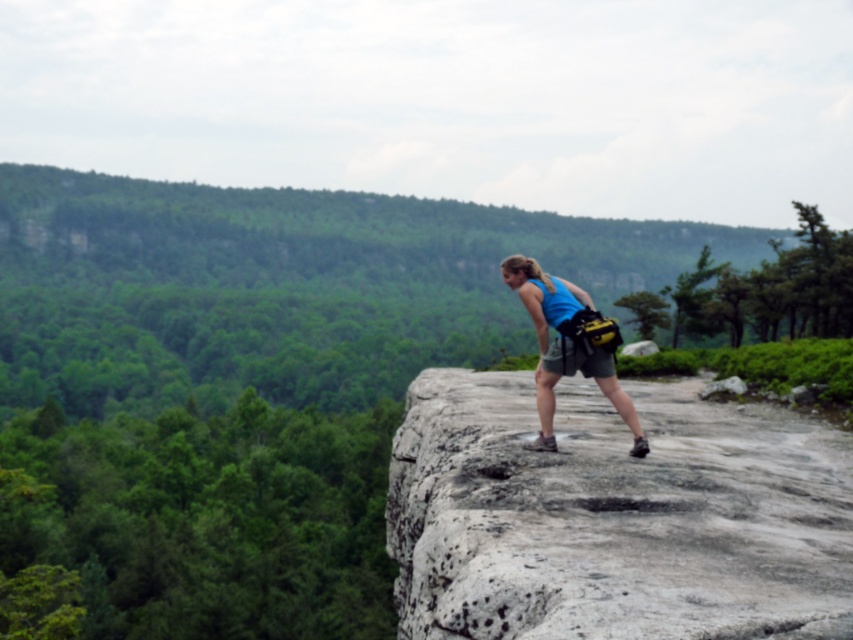
Is point (489, 516) closer to viewer compared to point (524, 304)?

Yes, point (489, 516) is closer to viewer.

Can you confirm if gray rough rock at center is positioned above blue fabric tank top at center?

No.

Does point (732, 420) lie in front of point (538, 380)?

No, (732, 420) is behind (538, 380).

Where is `gray rough rock at center`? Image resolution: width=853 pixels, height=640 pixels. gray rough rock at center is located at coordinates (614, 515).